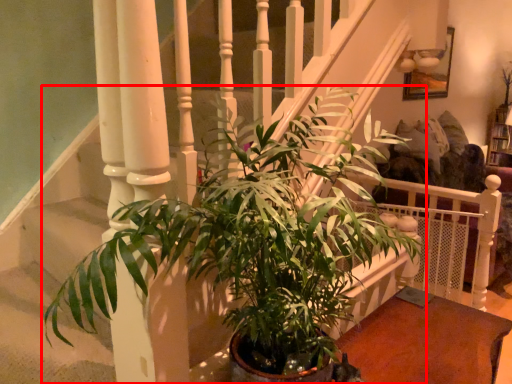
Question: From the image's perspective, where is houseplant (annotated by the red box) located in relation to table in the image?

Choices:
 (A) above
 (B) below

Answer: (A)